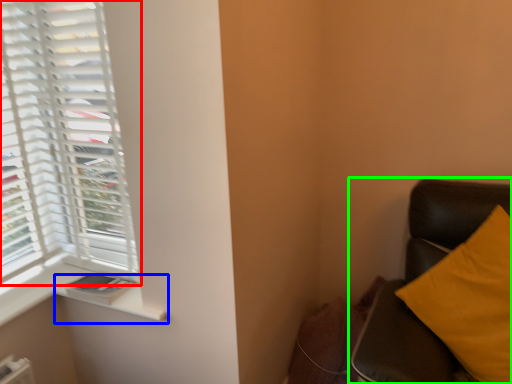
Question: Considering the real-world distances, which object is closest to window (highlighted by a red box)? window sill (highlighted by a blue box) or furniture (highlighted by a green box).

Choices:
 (A) window sill
 (B) furniture

Answer: (A)